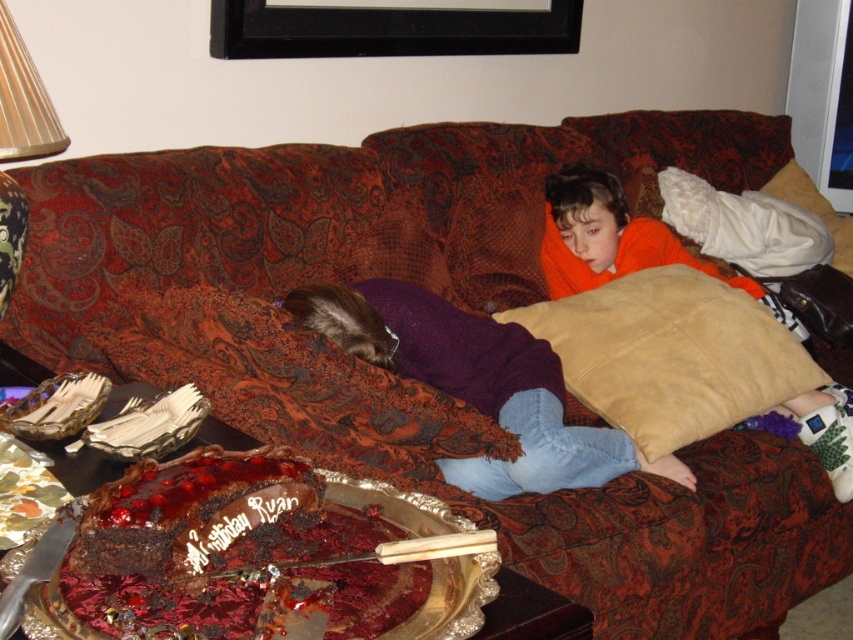
Question: Which of the following is the closest to the observer?

Choices:
 (A) chocolateshinycake at lower left
 (B) suede beige pillow at center
 (C) purple sweater at center

Answer: (A)

Question: Estimate the real-world distances between objects in this image. Which object is closer to the purple sweater at center?

Choices:
 (A) suede beige pillow at center
 (B) black wood picture frame at upper center
 (C) wooden lampshade at upper left
 (D) chocolateshinycake at lower left

Answer: (A)

Question: Is suede beige pillow at center wider than wooden lampshade at upper left?

Choices:
 (A) no
 (B) yes

Answer: (B)

Question: Which of these objects is positioned farthest from the purple sweater at center?

Choices:
 (A) chocolateshinycake at lower left
 (B) suede beige pillow at center

Answer: (A)

Question: Is black wood picture frame at upper center behind wooden lampshade at upper left?

Choices:
 (A) yes
 (B) no

Answer: (A)

Question: Observing the image, what is the correct spatial positioning of suede beige pillow at center in reference to wooden lampshade at upper left?

Choices:
 (A) above
 (B) below

Answer: (B)